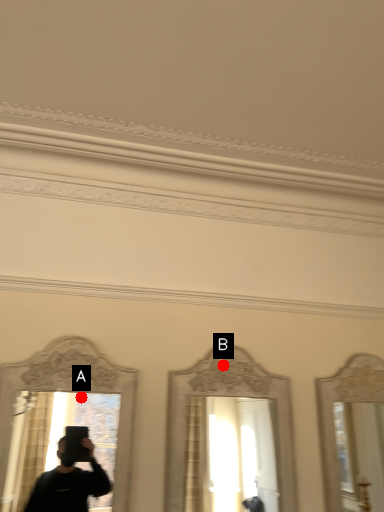
Question: Two points are circled on the image, labeled by A and B beside each circle. Among these points, which one is farthest from the camera?

Choices:
 (A) A is further
 (B) B is further

Answer: (B)